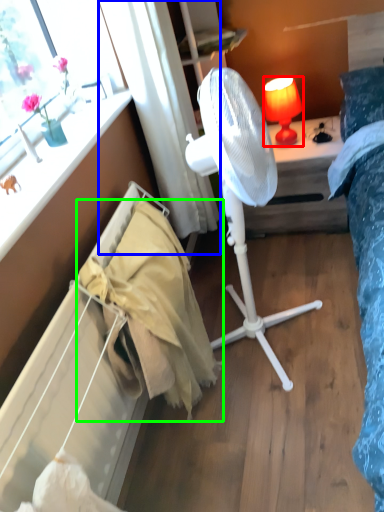
Question: Which object is positioned closest to lamp (highlighted by a red box)? Select from curtain (highlighted by a blue box) and blanket (highlighted by a green box).

Choices:
 (A) curtain
 (B) blanket

Answer: (A)